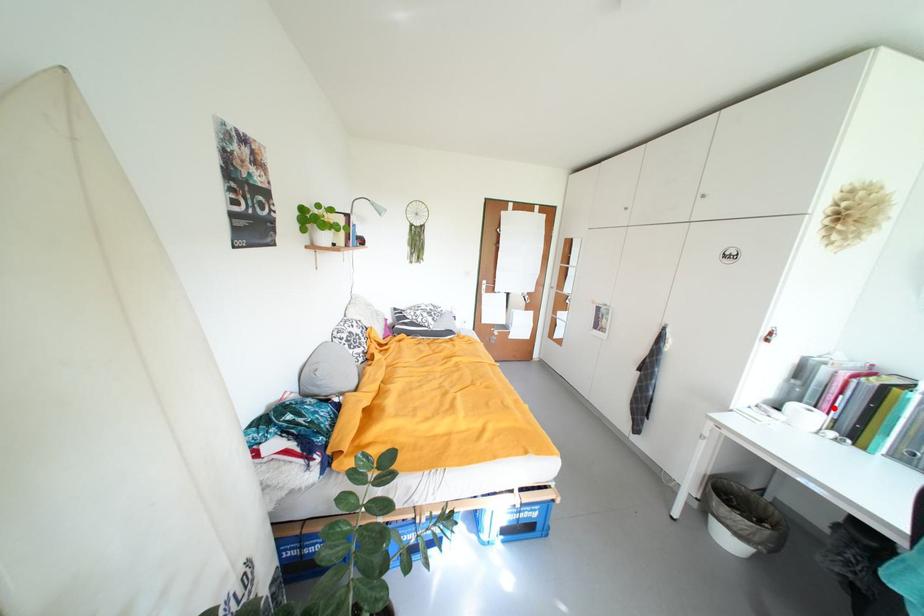
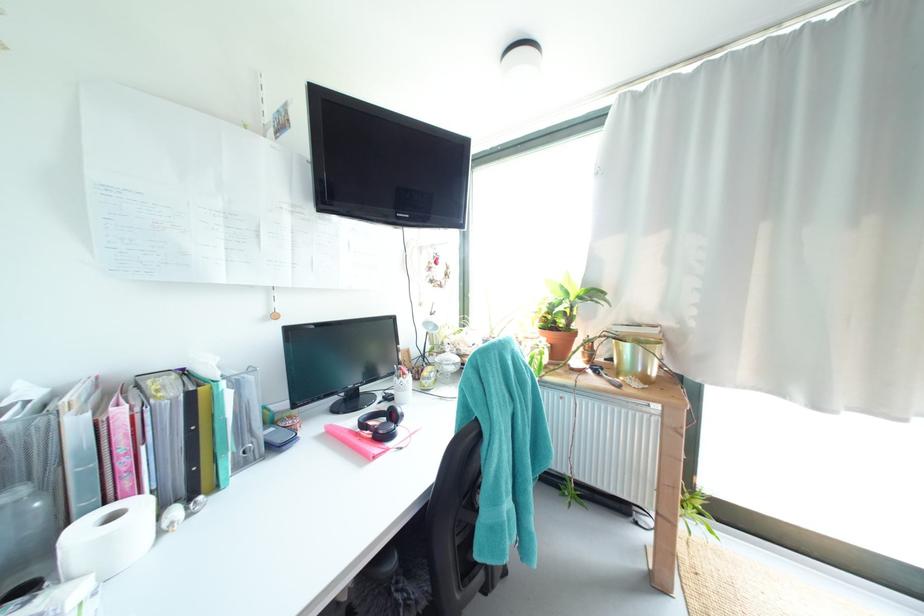
Locate, in the second image, the point that corresponds to the highlighted location in the first image.

(135, 485)